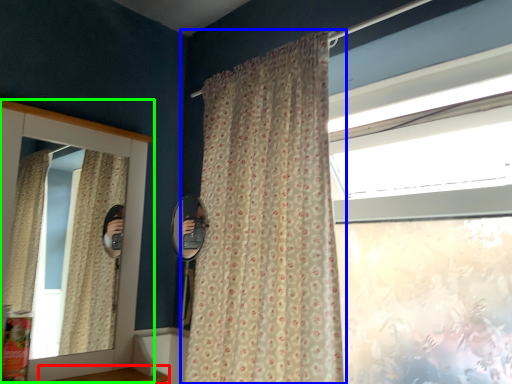
Question: Considering the real-world distances, which object is closest to window sill (highlighted by a red box)? curtain (highlighted by a blue box) or medicine cabinet (highlighted by a green box).

Choices:
 (A) curtain
 (B) medicine cabinet

Answer: (B)